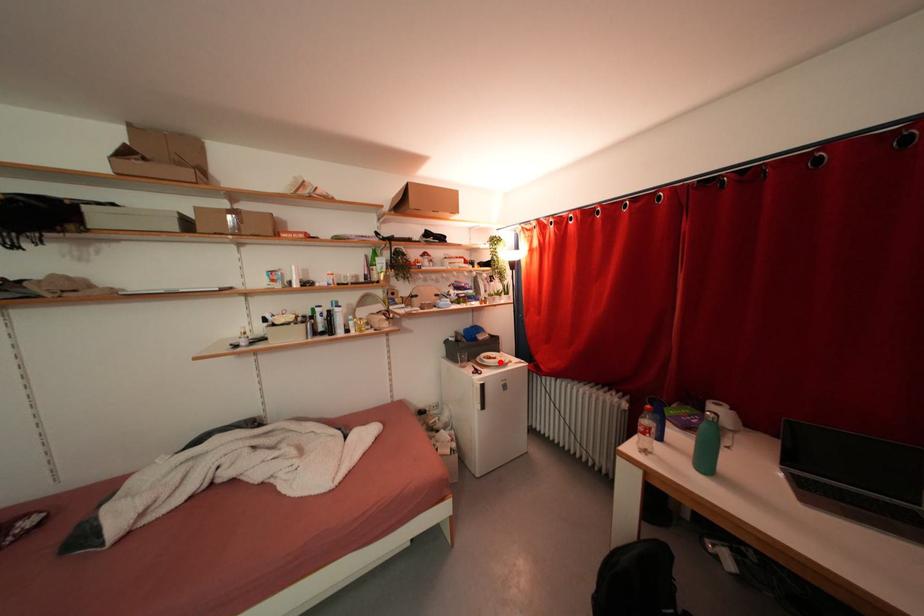
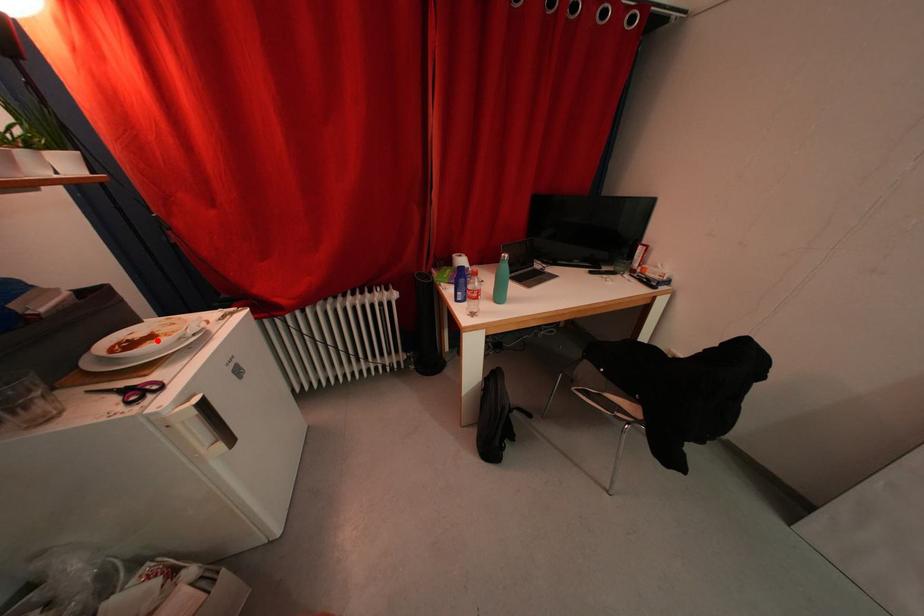
I am providing you with two images of the same scene from different viewpoints. A red point is marked on the first image and another point is marked on the second image. Is the red point in image1 aligned with the point shown in image2?

Yes